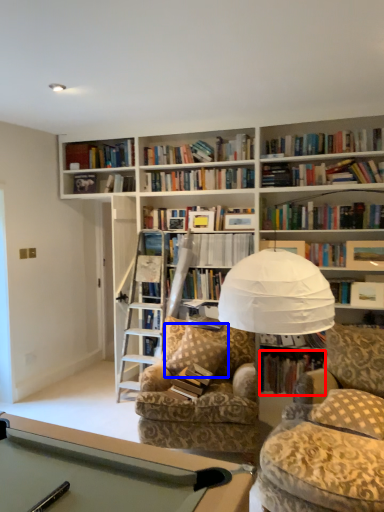
Question: Which point is further to the camera, book (highlighted by a red box) or pillow (highlighted by a blue box)?

Choices:
 (A) book
 (B) pillow

Answer: (A)